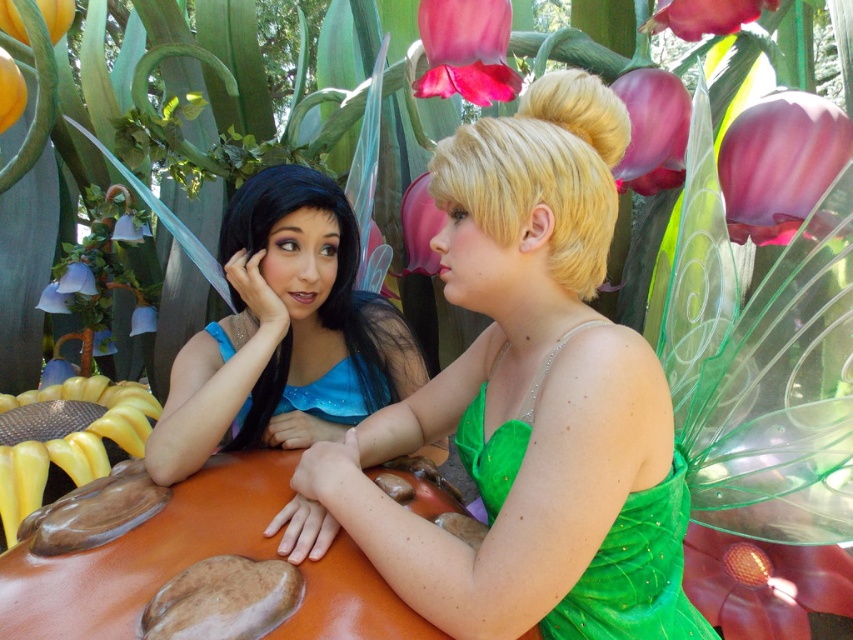
Question: Among these points, which one is farthest from the camera?

Choices:
 (A) (120, 221)
 (B) (18, 32)
 (C) (703, 20)

Answer: (B)

Question: Which of the following is the farthest from the observer?

Choices:
 (A) (84, 266)
 (B) (148, 314)
 (C) (357, 412)

Answer: (B)

Question: Can you confirm if blue satin dress at center is wider than matte blue flower at lower left?

Choices:
 (A) yes
 (B) no

Answer: (A)

Question: From the image, what is the correct spatial relationship of matte plastic flower at center in relation to matte blue flower at lower left?

Choices:
 (A) above
 (B) below

Answer: (A)

Question: Which object is farther from the camera taking this photo?

Choices:
 (A) pink silky petal at upper center
 (B) matte blue flower at lower left
 (C) pink translucent flower at upper center

Answer: (B)

Question: Does blue satin dress at center have a lesser width compared to matte white flower at center?

Choices:
 (A) no
 (B) yes

Answer: (A)